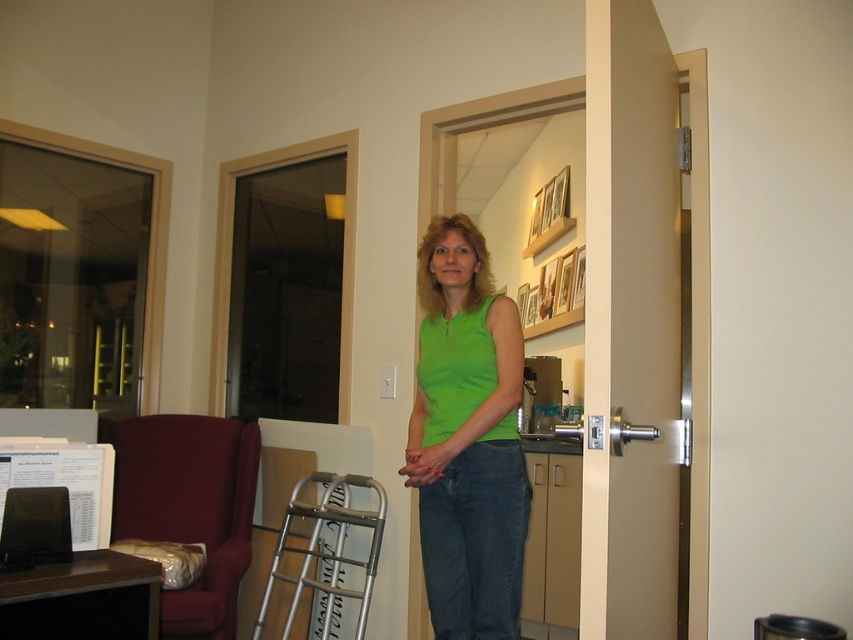
Question: Which object appears farthest from the camera in this image?

Choices:
 (A) green matte tank top at center
 (B) silver metallic walker at lower center
 (C) velvet red armchair at left

Answer: (B)

Question: Does velvet red armchair at left have a larger size compared to silver metallic walker at lower center?

Choices:
 (A) yes
 (B) no

Answer: (A)

Question: Which object appears farthest from the camera in this image?

Choices:
 (A) velvet red armchair at left
 (B) silver metallic walker at lower center
 (C) green matte tank top at center

Answer: (B)

Question: Can you confirm if velvet red armchair at left is positioned above silver metallic walker at lower center?

Choices:
 (A) yes
 (B) no

Answer: (A)

Question: Is velvet red armchair at left thinner than silver metallic walker at lower center?

Choices:
 (A) no
 (B) yes

Answer: (A)

Question: Which point is farther to the camera?

Choices:
 (A) (440, 532)
 (B) (260, 612)
 (C) (207, 556)

Answer: (C)